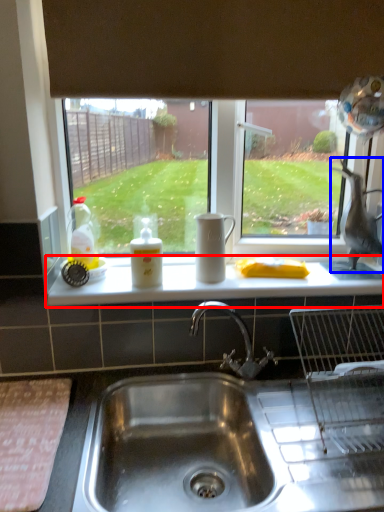
Question: Among these objects, which one is nearest to the camera, counter top (highlighted by a red box) or animal (highlighted by a blue box)?

Choices:
 (A) counter top
 (B) animal

Answer: (A)